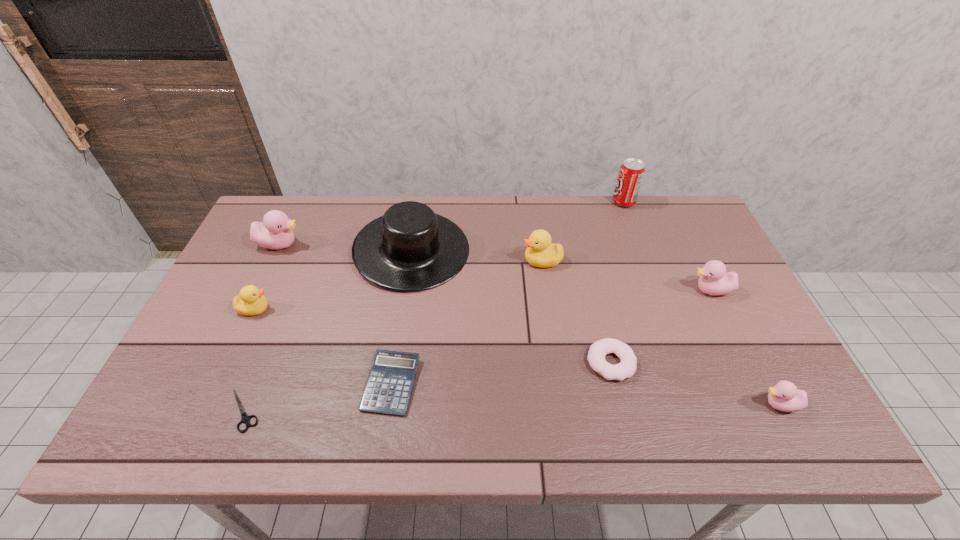
Locate an element on the screen. The image size is (960, 540). vacant space located on the face of the farther yellow duckling is located at coordinates tap(395, 261).

Identify the location of free region located 0.260m on the face of the farther yellow duckling. This screenshot has height=540, width=960. (435, 261).

Find the location of a particular element. vacant region located 0.160m on the face of the farther yellow duckling is located at coordinates (468, 261).

Find the location of `vacant area located on the front-facing side of the second biggest pink duckling`. vacant area located on the front-facing side of the second biggest pink duckling is located at coordinates (636, 291).

Locate an element on the screen. This screenshot has width=960, height=540. blank space located on the front-facing side of the second biggest pink duckling is located at coordinates (660, 291).

Locate an element on the screen. This screenshot has width=960, height=540. vacant position located 0.380m on the front-facing side of the second biggest pink duckling is located at coordinates (554, 291).

Identify the location of free space located on the face of the left yellow duckling. The width and height of the screenshot is (960, 540). (408, 309).

Find the location of a particular element. Image resolution: width=960 pixels, height=540 pixels. vacant space located 0.120m on the front-facing side of the smallest pink duckling is located at coordinates (707, 404).

At what (x,y) coordinates should I click in order to perform the action: click on vacant position located 0.110m on the front-facing side of the smallest pink duckling. Please return your answer as a coordinate pair (x, y). This screenshot has height=540, width=960. Looking at the image, I should click on (710, 404).

At what (x,y) coordinates should I click in order to perform the action: click on vacant space located 0.250m on the front-facing side of the smallest pink duckling. Please return your answer as a coordinate pair (x, y). This screenshot has width=960, height=540. Looking at the image, I should click on (649, 404).